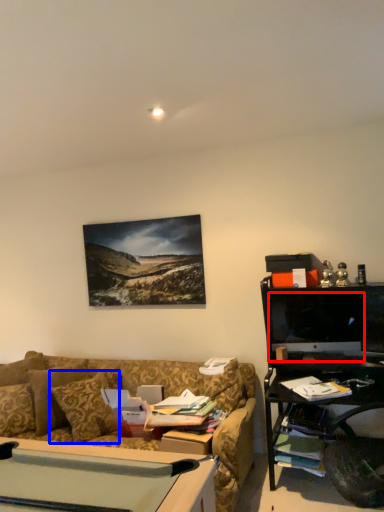
Question: Which object is further to the camera taking this photo, computer monitor (highlighted by a red box) or pillow (highlighted by a blue box)?

Choices:
 (A) computer monitor
 (B) pillow

Answer: (A)